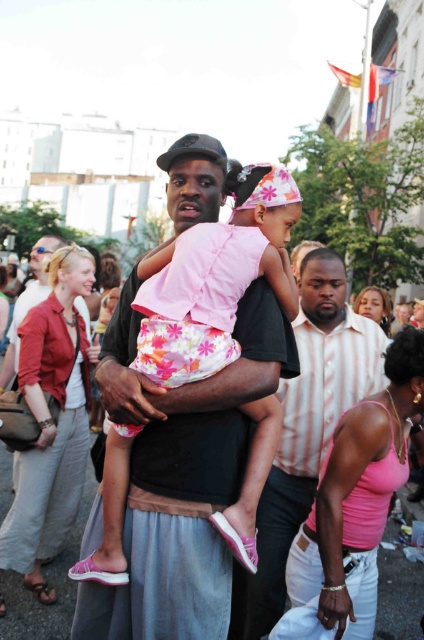
Looking at this image, who is positioned more to the right, floral fabric dress at center or pink fabric tank top at center?

Positioned to the right is pink fabric tank top at center.

Is floral fabric dress at center below pink fabric tank top at center?

Incorrect, floral fabric dress at center is not positioned below pink fabric tank top at center.

Between point (270, 211) and point (392, 465), which one is positioned in front?

Positioned in front is point (392, 465).

At what (x,y) coordinates should I click in order to perform the action: click on floral fabric dress at center. Please return your answer as a coordinate pair (x, y). The image size is (424, 640). Looking at the image, I should click on (214, 278).

Between point (312, 563) and point (42, 364), which one is positioned in front?

Point (312, 563)

Is the position of pink fabric tank top at center less distant than that of matte red blouse at center?

Yes, pink fabric tank top at center is in front of matte red blouse at center.

Locate an element on the screen. Image resolution: width=424 pixels, height=640 pixels. pink fabric tank top at center is located at coordinates (354, 506).

Does floral fabric dress at center come behind matte red blouse at center?

That is False.

What do you see at coordinates (214, 278) in the screenshot? This screenshot has height=640, width=424. I see `floral fabric dress at center` at bounding box center [214, 278].

Does point (259, 401) come in front of point (72, 520)?

Yes, it is.

You are a GUI agent. You are given a task and a screenshot of the screen. Output one action in this format:
    pyautogui.click(x=<x>, y=<y>)
    Task: Click on the floral fabric dress at center
    This screenshot has height=640, width=424.
    Given the screenshot: What is the action you would take?
    pyautogui.click(x=214, y=278)